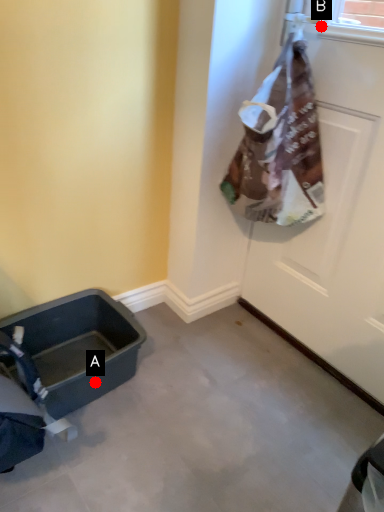
Question: Two points are circled on the image, labeled by A and B beside each circle. Which point appears farthest from the camera in this image?

Choices:
 (A) A is further
 (B) B is further

Answer: (A)